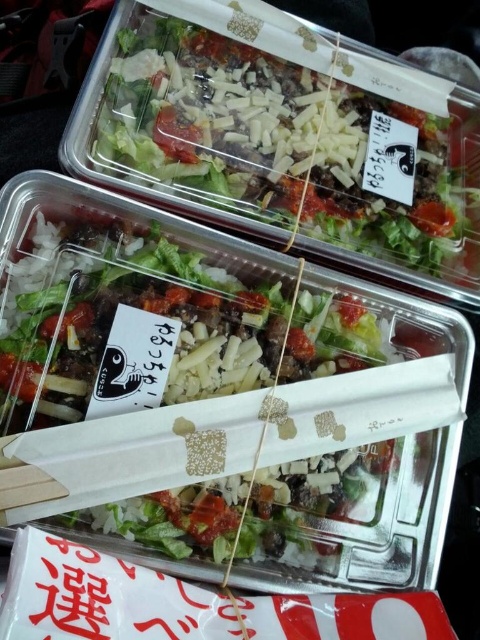
You are a delivery person who needs to pick up the salad container from the center of the image. The coordinates given are in a normalized format between 0 and 1. Can you confirm if the point at coordinates point (206, 392) is the correct location for the shiny plastic salad at center?

Yes, the point (206, 392) corresponds to the shiny plastic salad at center as stated in the objects description.

You are a delivery person who just picked up the salad containers. You need to place a sticker on the container. The sticker must be placed on the point that is closer to you. Which point should you choose between point (12, 403) and point (442, 118)?

Point (12, 403) is in front of point (442, 118), so you should place the sticker on point (12, 403) because it is closer to you.